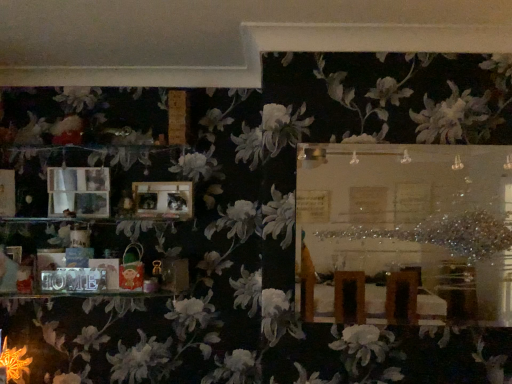
Where is `matte plastic bag at lower left`? matte plastic bag at lower left is located at coordinates (132, 269).

What is the approximate height of matte wooden picture frame at left, the 1th picture frame from the left?

9.71 inches.

The image size is (512, 384). What do you see at coordinates (78, 191) in the screenshot?
I see `matte wooden picture frame at left, which is the second picture frame from right to left` at bounding box center [78, 191].

Where is `matte plastic bag at lower left`? matte plastic bag at lower left is located at coordinates (132, 269).

Is orange textured flower at lower left inside the boundaries of matte plastic bag at lower left, or outside?

orange textured flower at lower left is spatially situated outside matte plastic bag at lower left.

Is orange textured flower at lower left taller or shorter than matte plastic bag at lower left?

Clearly, orange textured flower at lower left is shorter compared to matte plastic bag at lower left.

At what (x,y) coordinates should I click in order to perform the action: click on toy above the orange textured flower at lower left (from a real-world perspective). Please return your answer as a coordinate pair (x, y). Looking at the image, I should click on (132, 269).

From the image's perspective, is orange textured flower at lower left above matte plastic bag at lower left?

No, from the image's perspective, orange textured flower at lower left is not on top of matte plastic bag at lower left.

Is matte plastic bag at lower left in front of or behind wooden photo frame at center, the first picture frame when ordered from right to left, in the image?

Clearly, matte plastic bag at lower left is in front of wooden photo frame at center, the first picture frame when ordered from right to left.

Are matte plastic bag at lower left and wooden photo frame at center, the second picture frame positioned from the left, beside each other?

There is a gap between matte plastic bag at lower left and wooden photo frame at center, the second picture frame positioned from the left.

In the scene shown: Which of these two, matte plastic bag at lower left or wooden photo frame at center, the second picture frame positioned from the left, is wider?

matte plastic bag at lower left is wider.

Is wooden photo frame at center, the first picture frame when ordered from right to left, located within matte plastic bag at lower left?

No, wooden photo frame at center, the first picture frame when ordered from right to left, is not a part of matte plastic bag at lower left.

Considering the sizes of objects matte plastic bag at lower left and wooden frame at upper center in the image provided, who is shorter, matte plastic bag at lower left or wooden frame at upper center?

matte plastic bag at lower left is shorter.

Is matte plastic bag at lower left facing towards wooden frame at upper center?

No, matte plastic bag at lower left does not turn towards wooden frame at upper center.

From the image's perspective, is matte plastic bag at lower left on top of wooden frame at upper center?

Actually, matte plastic bag at lower left appears below wooden frame at upper center in the image.

Measure the distance between matte plastic bag at lower left and wooden frame at upper center.

The distance of matte plastic bag at lower left from wooden frame at upper center is 37.53 inches.

Would you say wooden frame at upper center is a long distance from orange textured flower at lower left?

Yes, wooden frame at upper center and orange textured flower at lower left are quite far apart.

Is wooden frame at upper center spatially inside orange textured flower at lower left, or outside of it?

wooden frame at upper center exists outside the volume of orange textured flower at lower left.

From the image's perspective, is wooden frame at upper center under orange textured flower at lower left?

Incorrect, from the image's perspective, wooden frame at upper center is higher than orange textured flower at lower left.

Is orange textured flower at lower left not near wooden photo frame at center, the second picture frame positioned from the left?

No, orange textured flower at lower left is not far from wooden photo frame at center, the second picture frame positioned from the left.

Looking at this image, is orange textured flower at lower left situated inside wooden photo frame at center, the first picture frame when ordered from right to left, or outside?

orange textured flower at lower left is located beyond the bounds of wooden photo frame at center, the first picture frame when ordered from right to left.

Where is `flower in front of the wooden photo frame at center, the second picture frame positioned from the left`? flower in front of the wooden photo frame at center, the second picture frame positioned from the left is located at coordinates (14, 362).

Which of these two, orange textured flower at lower left or wooden photo frame at center, the first picture frame when ordered from right to left, is thinner?

With smaller width is wooden photo frame at center, the first picture frame when ordered from right to left.

Who is bigger, wooden photo frame at center, the second picture frame positioned from the left, or orange textured flower at lower left?

Bigger between the two is orange textured flower at lower left.

This screenshot has height=384, width=512. I want to click on the 1st picture frame above the orange textured flower at lower left (from a real-world perspective), so 163,200.

In terms of width, does wooden photo frame at center, the first picture frame when ordered from right to left, look wider or thinner when compared to orange textured flower at lower left?

Clearly, wooden photo frame at center, the first picture frame when ordered from right to left, has less width compared to orange textured flower at lower left.

Which is behind, point (142, 190) or point (21, 377)?

The point (142, 190) is farther from the camera.

Considering the sizes of objects wooden photo frame at center, the first picture frame when ordered from right to left, and wooden frame at upper center in the image provided, who is shorter, wooden photo frame at center, the first picture frame when ordered from right to left, or wooden frame at upper center?

Standing shorter between the two is wooden photo frame at center, the first picture frame when ordered from right to left.

This screenshot has height=384, width=512. Find the location of `mirror that appears below the wooden photo frame at center, the second picture frame positioned from the left (from the image's perspective)`. mirror that appears below the wooden photo frame at center, the second picture frame positioned from the left (from the image's perspective) is located at coordinates (411, 216).

Is wooden photo frame at center, the first picture frame when ordered from right to left, facing away from wooden frame at upper center?

No, wooden photo frame at center, the first picture frame when ordered from right to left, is not facing the opposite direction of wooden frame at upper center.

The height and width of the screenshot is (384, 512). I want to click on toy on the right side of orange textured flower at lower left, so click(x=132, y=269).

Find the location of `toy that appears on the left of wooden photo frame at center, the first picture frame when ordered from right to left`. toy that appears on the left of wooden photo frame at center, the first picture frame when ordered from right to left is located at coordinates (132, 269).

Looking at the image, which one is located closer to wooden photo frame at center, the second picture frame positioned from the left, orange textured flower at lower left or wooden frame at upper center?

The object closer to wooden photo frame at center, the second picture frame positioned from the left, is wooden frame at upper center.

Estimate the real-world distances between objects in this image. Which object is closer to matte plastic bag at lower left, matte wooden picture frame at left, the 1th picture frame from the left, or wooden frame at upper center?

matte wooden picture frame at left, the 1th picture frame from the left.

From the image, which object appears to be farther from matte wooden picture frame at left, the 1th picture frame from the left, wooden photo frame at center, the second picture frame positioned from the left, or matte plastic bag at lower left?

Among the two, matte plastic bag at lower left is located further to matte wooden picture frame at left, the 1th picture frame from the left.

Which object lies further to the anchor point matte wooden picture frame at left, the 1th picture frame from the left, wooden photo frame at center, the second picture frame positioned from the left, or wooden frame at upper center?

Among the two, wooden frame at upper center is located further to matte wooden picture frame at left, the 1th picture frame from the left.

Estimate the real-world distances between objects in this image. Which object is closer to orange textured flower at lower left, wooden photo frame at center, the second picture frame positioned from the left, or matte plastic bag at lower left?

matte plastic bag at lower left.

Estimate the real-world distances between objects in this image. Which object is closer to matte wooden picture frame at left, which is the second picture frame from right to left, orange textured flower at lower left or wooden photo frame at center, the first picture frame when ordered from right to left?

Based on the image, wooden photo frame at center, the first picture frame when ordered from right to left, appears to be nearer to matte wooden picture frame at left, which is the second picture frame from right to left.

Based on their spatial positions, is wooden frame at upper center or orange textured flower at lower left further from matte plastic bag at lower left?

Among the two, wooden frame at upper center is located further to matte plastic bag at lower left.

In the scene shown: Looking at the image, which one is located further to orange textured flower at lower left, wooden frame at upper center or wooden photo frame at center, the first picture frame when ordered from right to left?

wooden frame at upper center is further to orange textured flower at lower left.

This screenshot has width=512, height=384. What are the coordinates of `toy between matte wooden picture frame at left, which is the second picture frame from right to left, and wooden photo frame at center, the first picture frame when ordered from right to left, in the horizontal direction` in the screenshot? It's located at (132, 269).

At what (x,y) coordinates should I click in order to perform the action: click on picture frame located between matte plastic bag at lower left and wooden frame at upper center in the left-right direction. Please return your answer as a coordinate pair (x, y). This screenshot has width=512, height=384. Looking at the image, I should click on (163, 200).

Locate an element on the screen. The height and width of the screenshot is (384, 512). toy between orange textured flower at lower left and wooden frame at upper center from left to right is located at coordinates (132, 269).

This screenshot has height=384, width=512. Identify the location of toy situated between matte wooden picture frame at left, which is the second picture frame from right to left, and wooden frame at upper center from left to right. (132, 269).